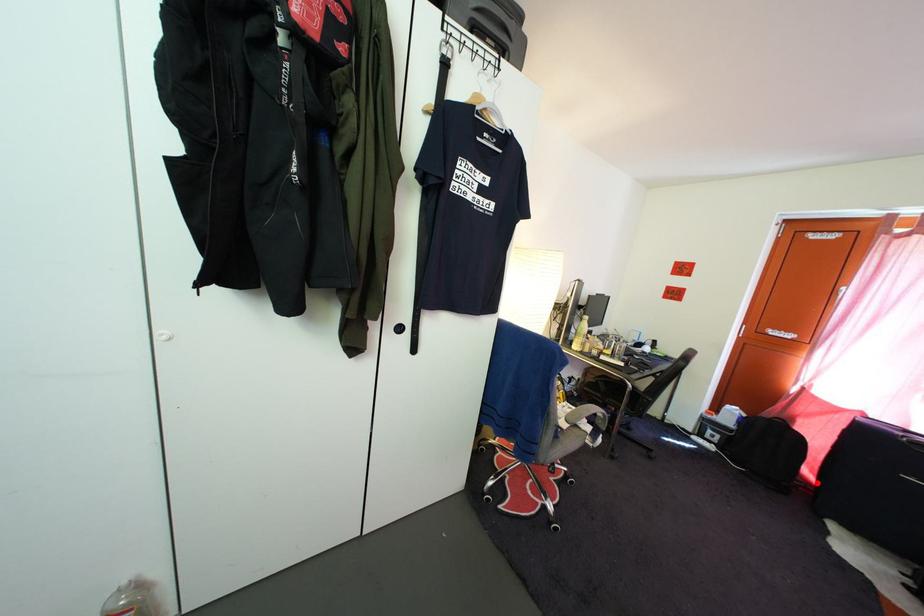
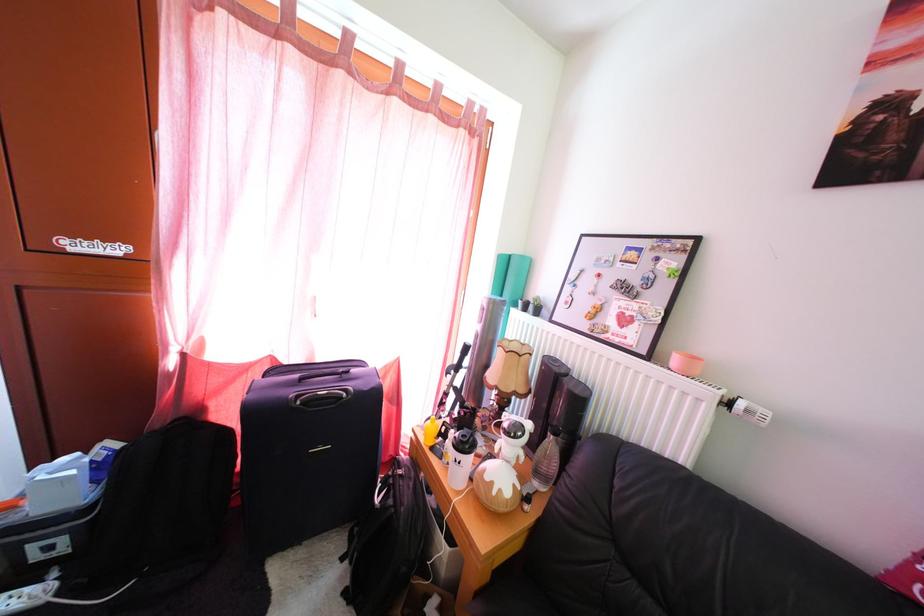
Question: I am providing you with two images of the same scene from different viewpoints. A red point is marked on the first image. Can you still see the location of the red point in image 2?

Choices:
 (A) Yes
 (B) No

Answer: (B)